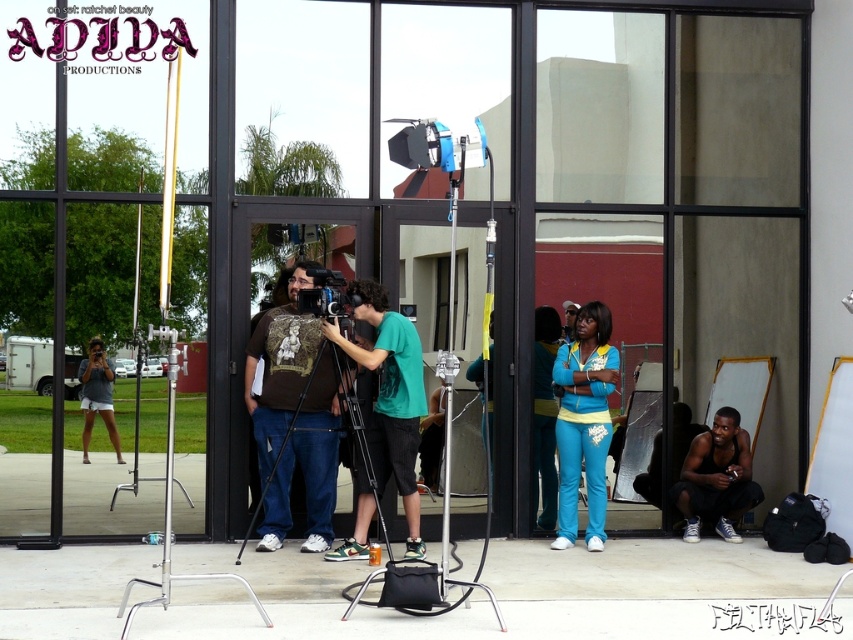
Question: Which of the following is the farthest from the observer?

Choices:
 (A) (548, 484)
 (B) (486, 234)

Answer: (A)

Question: Is the position of turquoise fabric pants at right less distant than that of black metal tripod at center?

Choices:
 (A) no
 (B) yes

Answer: (A)

Question: Does green matte shirt at center appear over black tank top at lower right?

Choices:
 (A) no
 (B) yes

Answer: (B)

Question: Considering the real-world distances, which object is farthest from the black matte tripod at center?

Choices:
 (A) green matte shirt at center
 (B) black metal tripod at center

Answer: (B)

Question: Which point appears closest to the camera in this image?

Choices:
 (A) (281, 486)
 (B) (567, 404)
 (C) (474, 584)

Answer: (C)

Question: Can you confirm if black matte tripod at center is positioned to the left of black tank top at lower right?

Choices:
 (A) no
 (B) yes

Answer: (B)